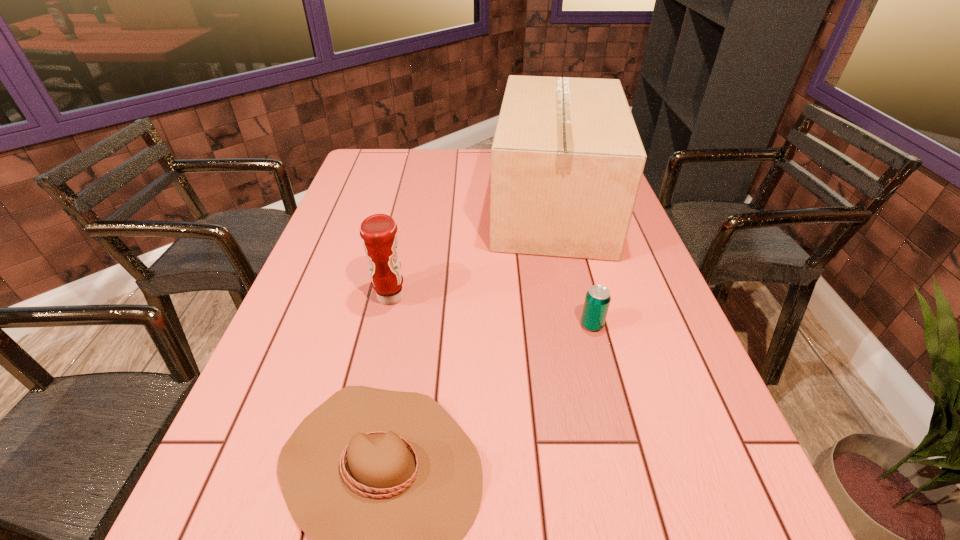
Locate an element on the screen. This screenshot has height=540, width=960. the farthest object is located at coordinates (567, 160).

You are a GUI agent. You are given a task and a screenshot of the screen. Output one action in this format:
    pyautogui.click(x=<x>, y=<y>)
    Task: Click on the box
    Image resolution: width=960 pixels, height=540 pixels.
    Given the screenshot: What is the action you would take?
    pyautogui.click(x=567, y=160)

Where is `the second farthest object`? the second farthest object is located at coordinates (378, 231).

Locate an element on the screen. condiment is located at coordinates (378, 231).

Image resolution: width=960 pixels, height=540 pixels. Identify the location of beer can. (597, 300).

Where is `the third farthest object`? the third farthest object is located at coordinates (597, 300).

Image resolution: width=960 pixels, height=540 pixels. What are the coordinates of `free space located on the front of the tallest object` in the screenshot? It's located at coord(596,382).

Where is `vacant space located 0.350m on the right of the condiment`? vacant space located 0.350m on the right of the condiment is located at coordinates (547, 297).

Find the location of a particular element. Image resolution: width=960 pixels, height=540 pixels. free spot located 0.120m on the back of the second nearest object is located at coordinates (581, 283).

The width and height of the screenshot is (960, 540). I want to click on object positioned at the far edge, so click(x=567, y=160).